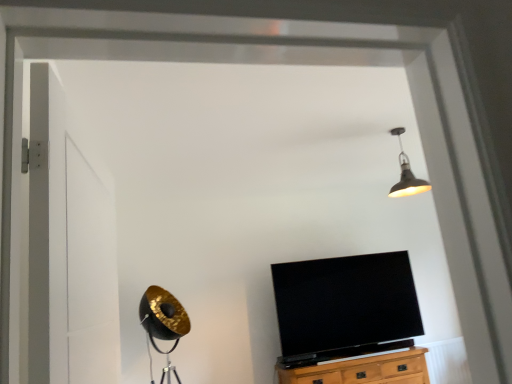
Question: Does wooden cabinet at lower center contain black glossy tv at center?

Choices:
 (A) no
 (B) yes

Answer: (A)

Question: From a real-world perspective, is wooden cabinet at lower center positioned under black glossy tv at center based on gravity?

Choices:
 (A) yes
 (B) no

Answer: (A)

Question: Does wooden cabinet at lower center appear on the right side of black glossy tv at center?

Choices:
 (A) no
 (B) yes

Answer: (B)

Question: Does wooden cabinet at lower center come behind black glossy tv at center?

Choices:
 (A) yes
 (B) no

Answer: (B)

Question: Does wooden cabinet at lower center have a greater height compared to black glossy tv at center?

Choices:
 (A) yes
 (B) no

Answer: (B)

Question: Does point (335, 365) appear closer or farther from the camera than point (50, 243)?

Choices:
 (A) closer
 (B) farther

Answer: (B)

Question: Is wooden cabinet at lower center to the left or to the right of white matte door at left in the image?

Choices:
 (A) left
 (B) right

Answer: (B)

Question: Is wooden cabinet at lower center wider or thinner than white matte door at left?

Choices:
 (A) wide
 (B) thin

Answer: (A)

Question: From the image's perspective, relative to white matte door at left, is wooden cabinet at lower center above or below?

Choices:
 (A) below
 (B) above

Answer: (A)

Question: Is metallic pendant light at upper center wider or thinner than white matte door at left?

Choices:
 (A) wide
 (B) thin

Answer: (A)

Question: From the image's perspective, is metallic pendant light at upper center above or below white matte door at left?

Choices:
 (A) above
 (B) below

Answer: (A)

Question: Is metallic pendant light at upper center in front of or behind white matte door at left in the image?

Choices:
 (A) behind
 (B) front

Answer: (A)

Question: Is metallic pendant light at upper center spatially inside white matte door at left, or outside of it?

Choices:
 (A) outside
 (B) inside

Answer: (A)

Question: From a real-world perspective, is black glossy tv at center positioned above or below wooden cabinet at lower center?

Choices:
 (A) below
 (B) above

Answer: (B)

Question: From the image's perspective, is black glossy tv at center above or below wooden cabinet at lower center?

Choices:
 (A) below
 (B) above

Answer: (B)